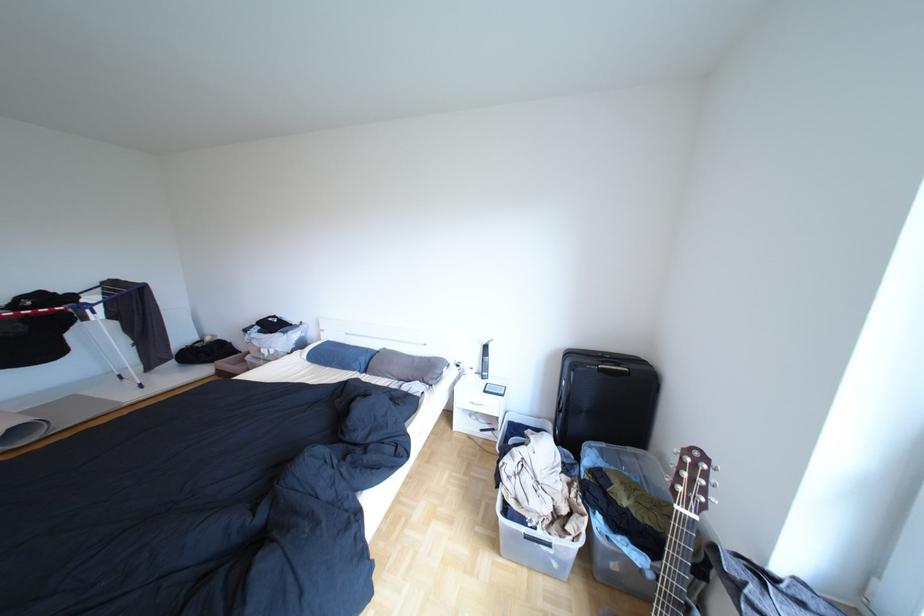
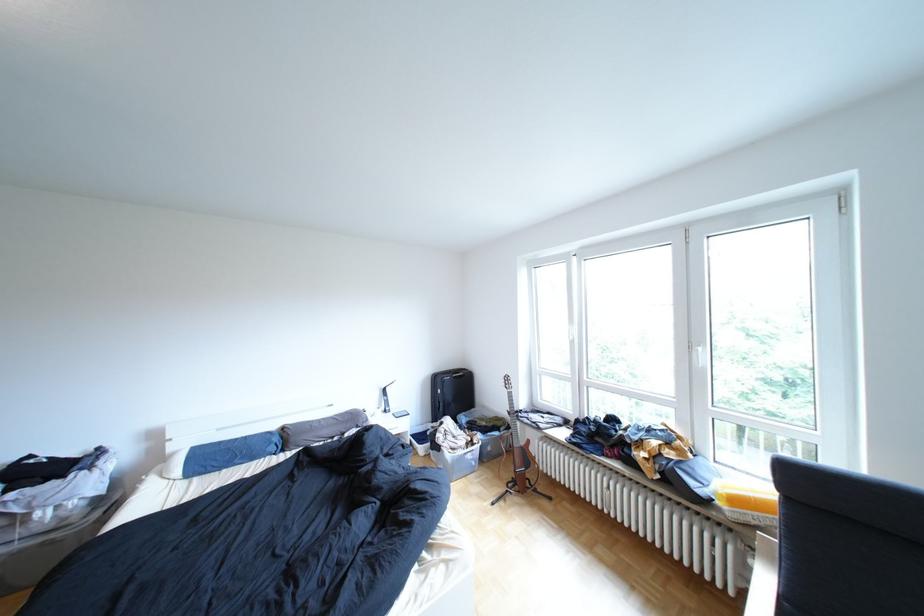
Where in the second image is the point corresponding to the point at 392,346 from the first image?

(289, 427)